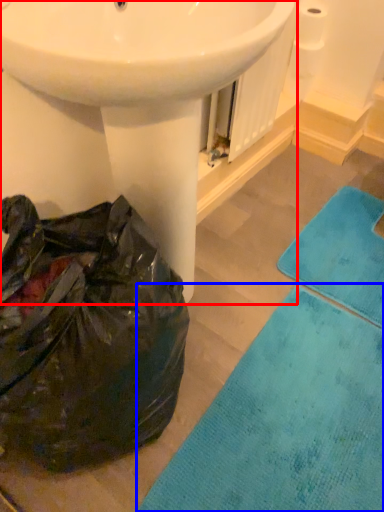
Question: Among these objects, which one is nearest to the camera, sink (highlighted by a red box) or bath mat (highlighted by a blue box)?

Choices:
 (A) sink
 (B) bath mat

Answer: (A)